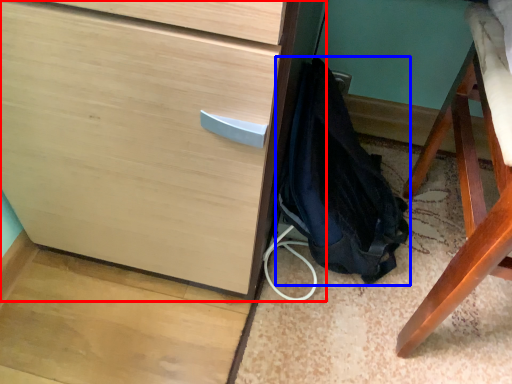
Question: Among these objects, which one is farthest to the camera, chest of drawers (highlighted by a red box) or backpack (highlighted by a blue box)?

Choices:
 (A) chest of drawers
 (B) backpack

Answer: (B)